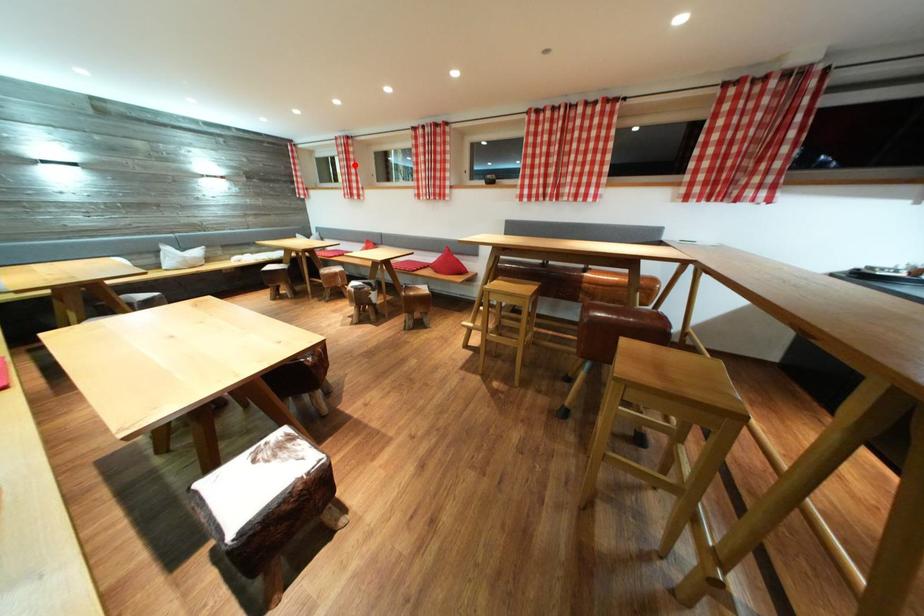
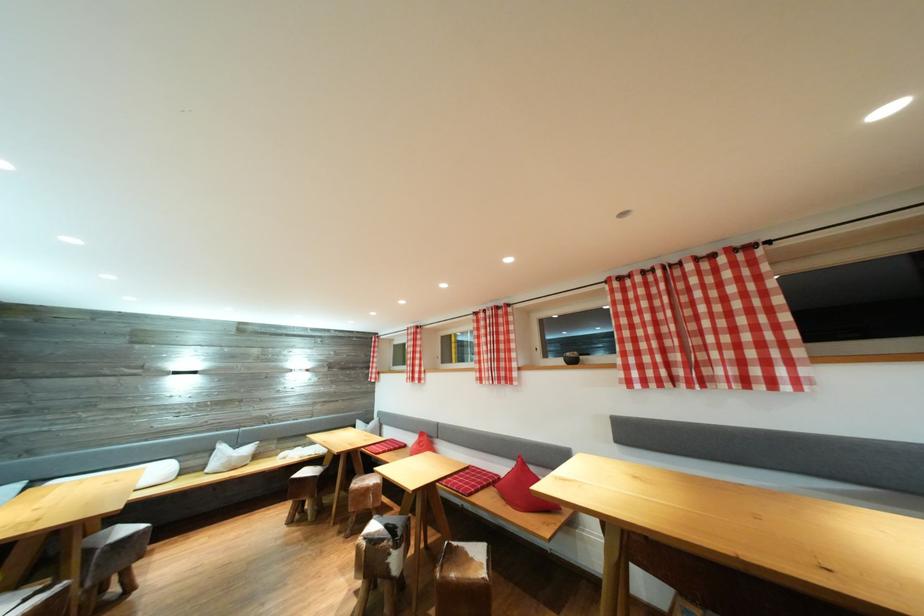
Locate, in the second image, the point that corresponds to the highlighted location in the first image.

(421, 351)